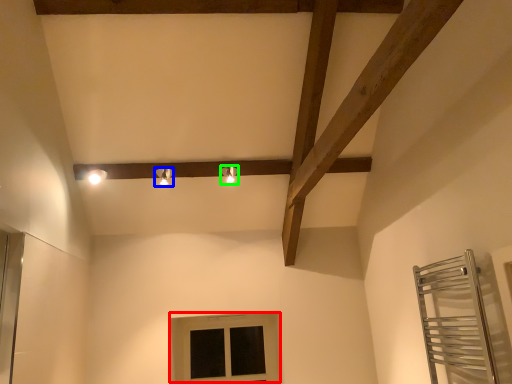
Question: Considering the real-world distances, which object is closest to window (highlighted by a red box)? light fixture (highlighted by a blue box) or light fixture (highlighted by a green box).

Choices:
 (A) light fixture
 (B) light fixture

Answer: (B)